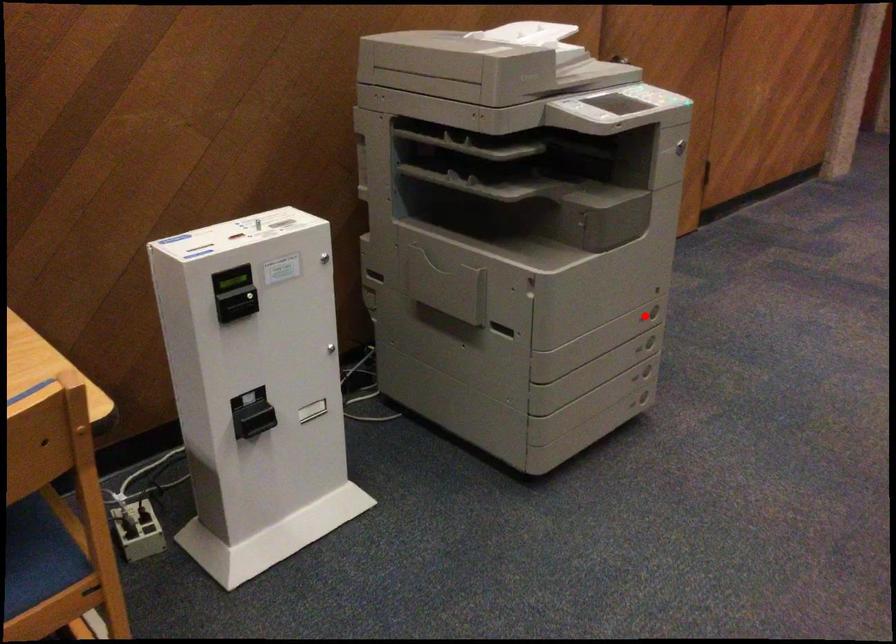
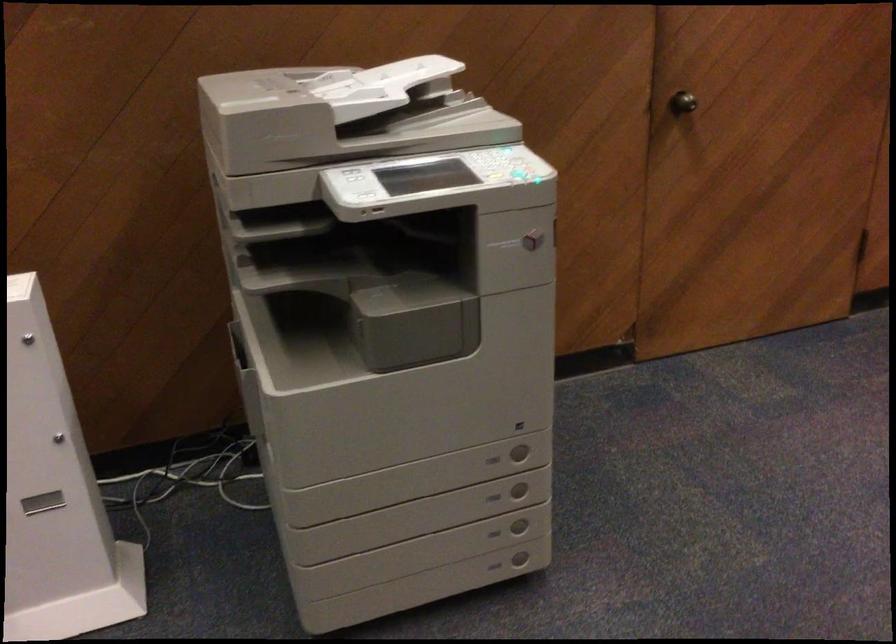
Question: I am providing you with two images of the same scene from different viewpoints. Given a red point in image1, look at the same physical point in image2. Is it:

Choices:
 (A) Closer to the viewpoint
 (B) Farther from the viewpoint

Answer: (A)